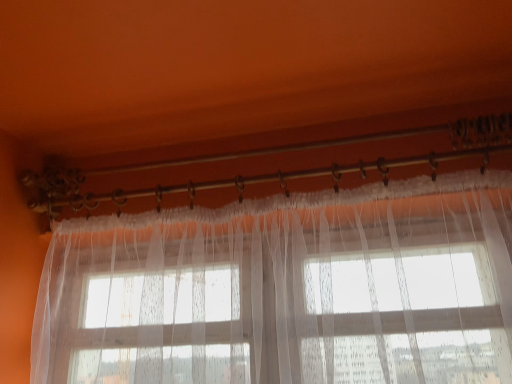
What do you see at coordinates (287, 290) in the screenshot? I see `white sheer curtain at center` at bounding box center [287, 290].

Image resolution: width=512 pixels, height=384 pixels. In order to click on white sheer curtain at center in this screenshot , I will do `click(287, 290)`.

What is the approximate width of white sheer curtain at center?

11.09 inches.

This screenshot has height=384, width=512. I want to click on white sheer curtain at center, so (x=287, y=290).